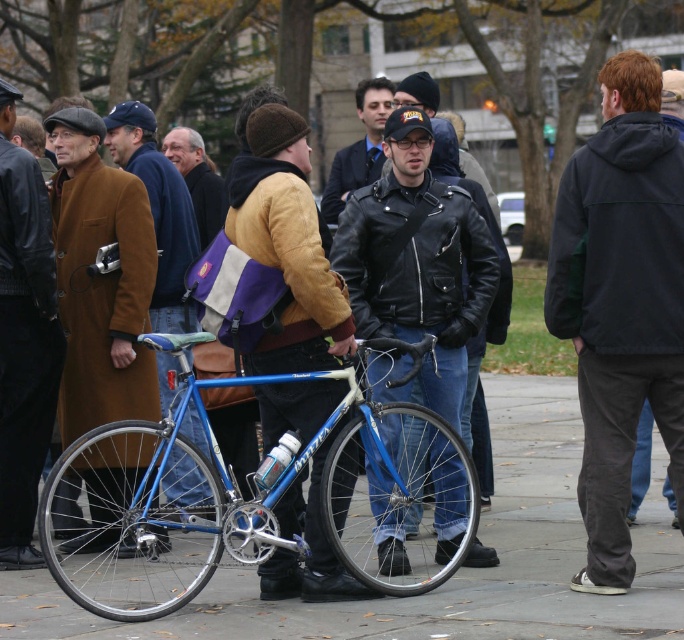
Question: Is brown leather coat at left positioned before brown woolen coat at center?

Choices:
 (A) no
 (B) yes

Answer: (B)

Question: Which of the following is the farthest from the observer?

Choices:
 (A) (640, 448)
 (B) (144, 316)

Answer: (A)

Question: Is the position of brown wool coat at left less distant than that of dark gray hooded jacket at right?

Choices:
 (A) yes
 (B) no

Answer: (B)

Question: Which of the following is the closest to the observer?

Choices:
 (A) (207, 214)
 (B) (456, 499)
 (C) (155, 173)

Answer: (B)

Question: Does brown woolen coat at center have a lesser width compared to dark gray hooded jacket at right?

Choices:
 (A) no
 (B) yes

Answer: (B)

Question: Among these objects, which one is nearest to the camera?

Choices:
 (A) brown wool coat at left
 (B) dark gray hooded jacket at right
 (C) blue metallic bicycle at center

Answer: (C)